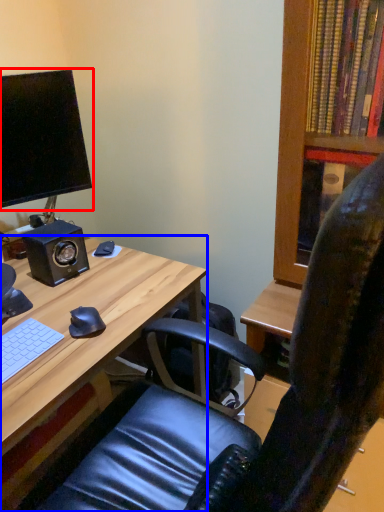
Question: Which of the following is the farthest to the observer, computer monitor (highlighted by a red box) or desk (highlighted by a blue box)?

Choices:
 (A) computer monitor
 (B) desk

Answer: (A)